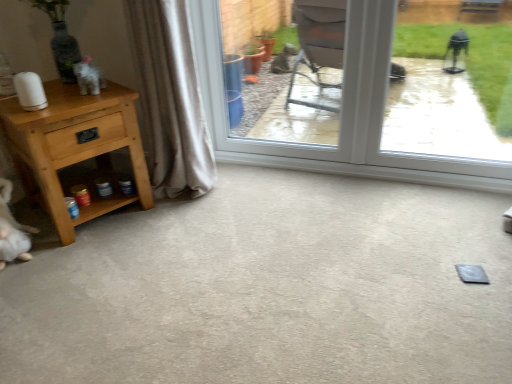
Question: Considering the positions of point (236, 216) and point (77, 64), is point (236, 216) closer or farther from the camera than point (77, 64)?

Choices:
 (A) farther
 (B) closer

Answer: (A)

Question: Is gray carpet at lower left wider or thinner than white glossy elephant at upper left?

Choices:
 (A) wide
 (B) thin

Answer: (A)

Question: Estimate the real-world distances between objects in this image. Which object is farther from the light brown wood nightstand at left?

Choices:
 (A) transparent glass window at center
 (B) white glossy elephant at upper left
 (C) gray carpet at lower left
 (D) beige fabric curtain at left

Answer: (A)

Question: Estimate the real-world distances between objects in this image. Which object is closer to the gray carpet at lower left?

Choices:
 (A) white glossy elephant at upper left
 (B) beige fabric curtain at left
 (C) light brown wood nightstand at left
 (D) transparent glass window at center

Answer: (C)